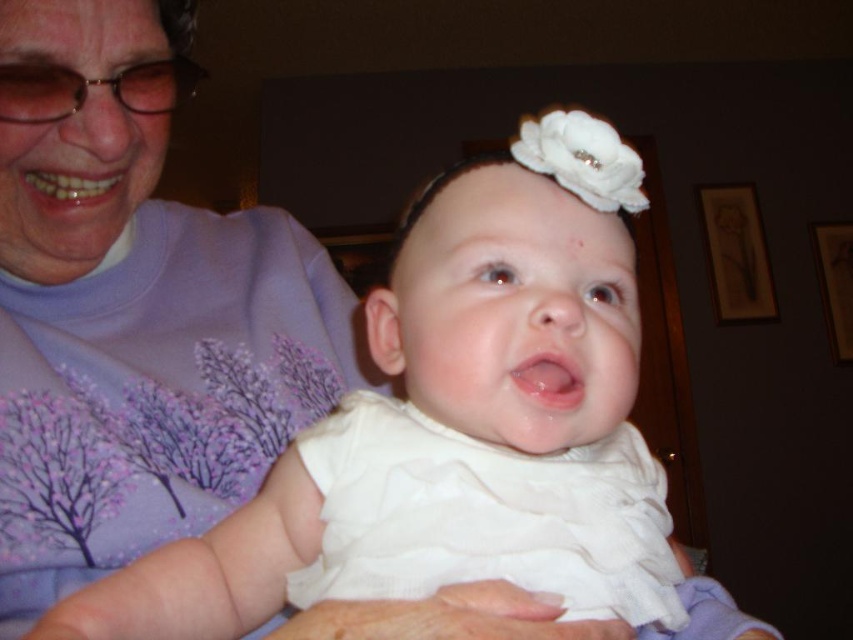
Question: Which point is closer to the camera taking this photo?

Choices:
 (A) (263, 508)
 (B) (134, 172)

Answer: (A)

Question: Can you confirm if white satin dress at center is positioned to the right of purple soft fabric shirt at upper left?

Choices:
 (A) yes
 (B) no

Answer: (A)

Question: Does white satin dress at center have a larger size compared to purple soft fabric shirt at upper left?

Choices:
 (A) yes
 (B) no

Answer: (B)

Question: Is white satin dress at center above purple soft fabric shirt at upper left?

Choices:
 (A) yes
 (B) no

Answer: (B)